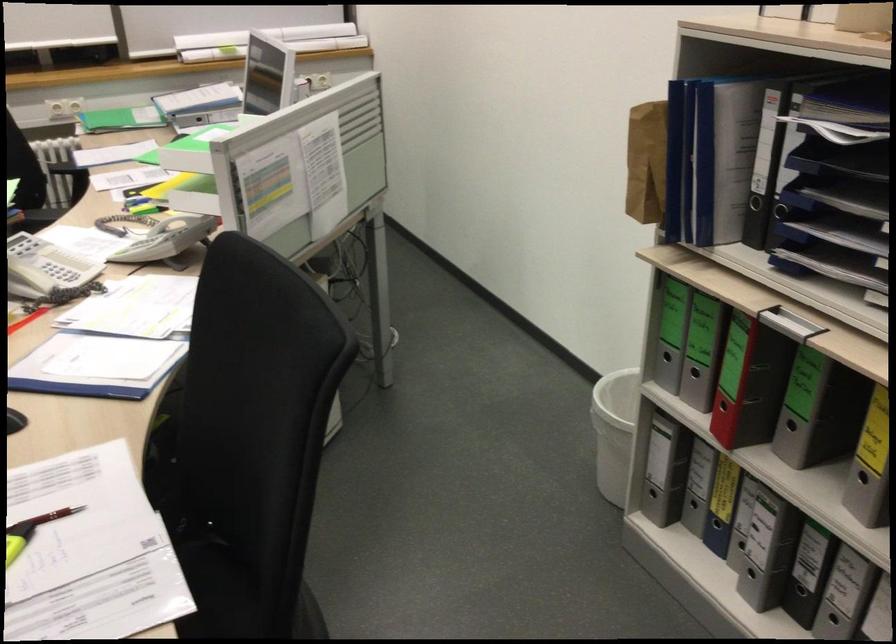
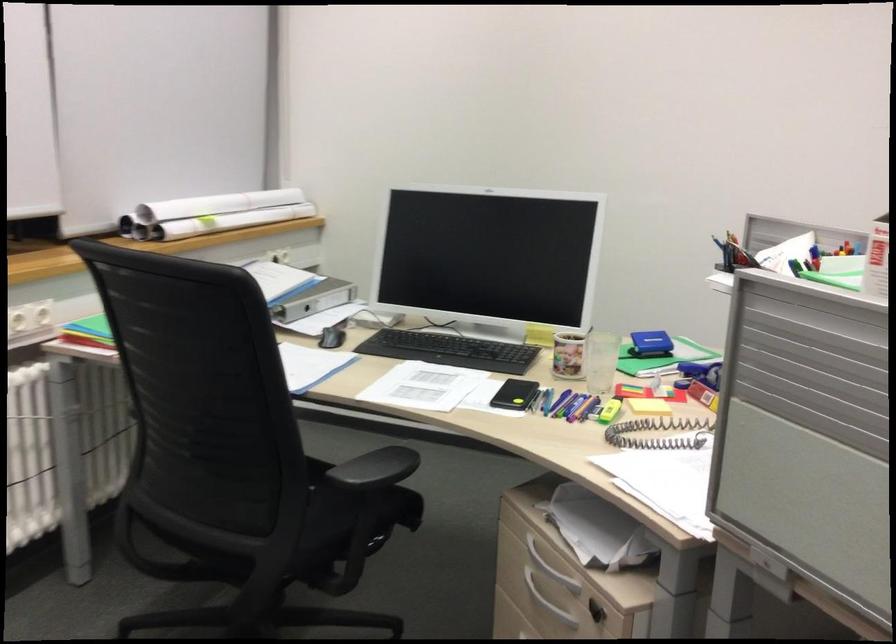
Find the pixel in the second image that matches pixel 133 212 in the first image.

(609, 411)